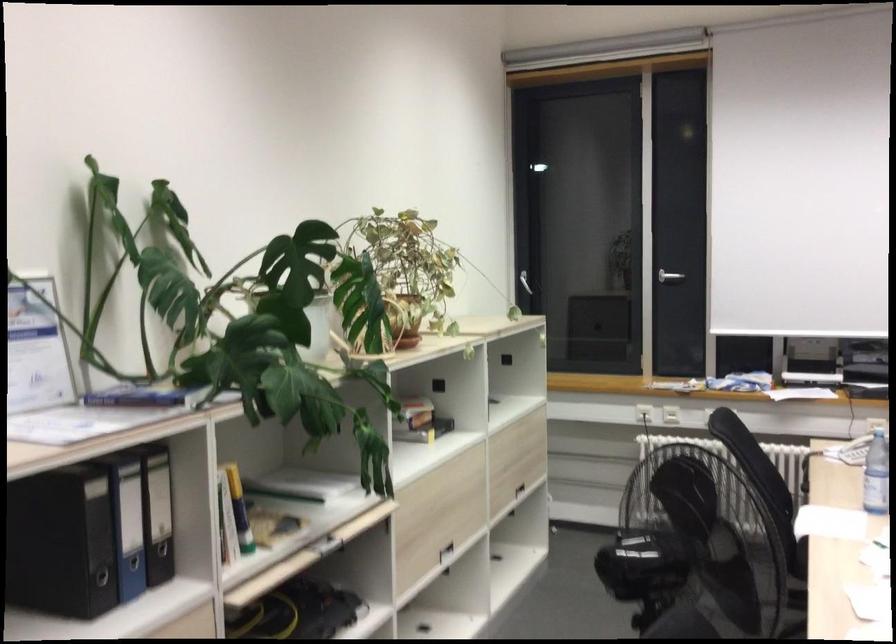
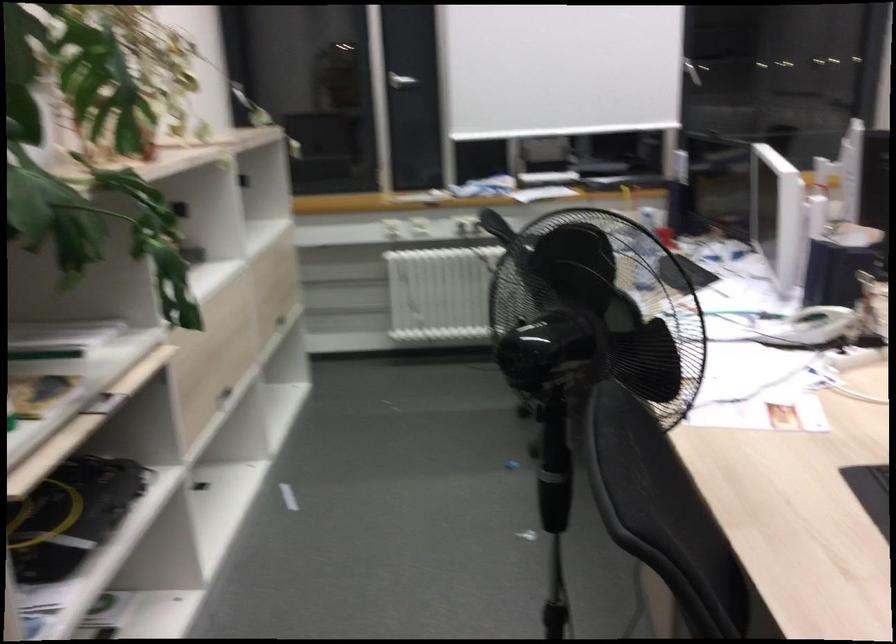
Question: How did the camera likely rotate?

Choices:
 (A) Left
 (B) Right
 (C) Up
 (D) Down

Answer: (B)